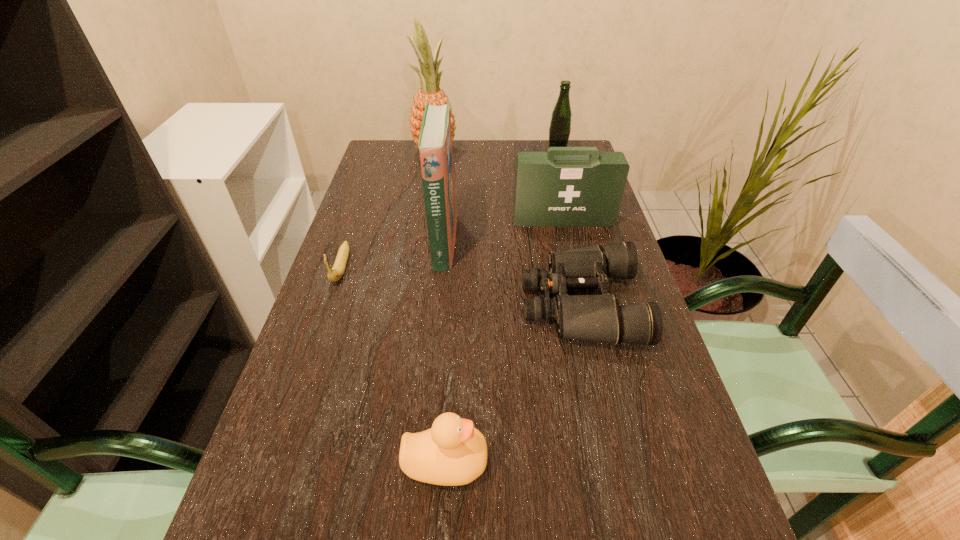
Identify the location of vacant space located 0.320m on the left of the fifth shortest object. pos(449,160).

Find the location of a particular element. The image size is (960, 540). free space located on the front-facing side of the first-aid kit is located at coordinates (585, 310).

The width and height of the screenshot is (960, 540). I want to click on vacant area located 0.360m on the face of the duck, so click(705, 461).

Locate an element on the screen. The height and width of the screenshot is (540, 960). vacant space located at the stem of the banana is located at coordinates (276, 457).

Identify the location of free region located 0.320m through the eyepieces of the binoculars. The image size is (960, 540). (379, 305).

Image resolution: width=960 pixels, height=540 pixels. Identify the location of vacant area located 0.060m through the eyepieces of the binoculars. (495, 305).

Locate an element on the screen. This screenshot has width=960, height=540. free space located through the eyepieces of the binoculars is located at coordinates (416, 305).

Locate an element on the screen. The image size is (960, 540). pineapple situated at the far edge is located at coordinates (430, 91).

You are a GUI agent. You are given a task and a screenshot of the screen. Output one action in this format:
    pyautogui.click(x=<x>, y=<y>)
    Task: Click on the beer bottle that is at the far edge
    
    Given the screenshot: What is the action you would take?
    click(x=560, y=126)

Find the location of `pineapple located in the left edge section of the desktop`. pineapple located in the left edge section of the desktop is located at coordinates (430, 91).